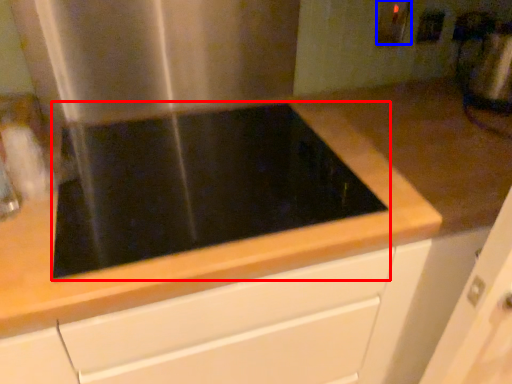
Question: Which object appears farthest to the camera in this image, gas stove (highlighted by a red box) or electric outlet (highlighted by a blue box)?

Choices:
 (A) gas stove
 (B) electric outlet

Answer: (B)